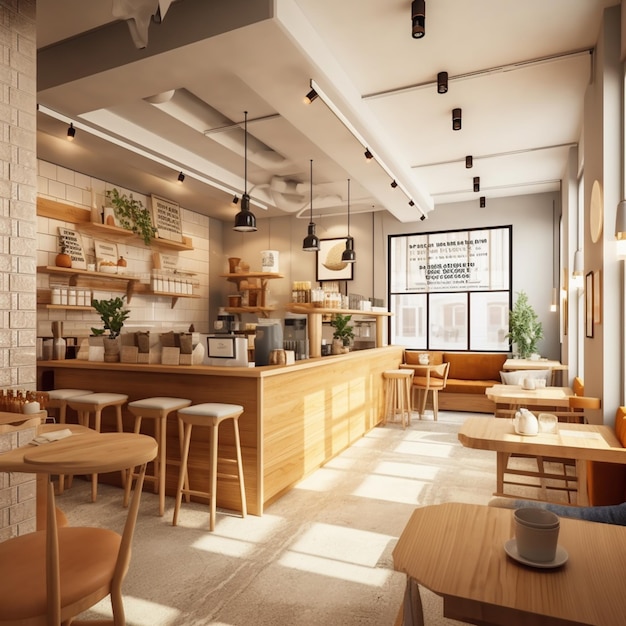
Locate an element on the screen. The width and height of the screenshot is (626, 626). potted plant is located at coordinates (114, 315), (129, 213), (337, 332), (526, 344).